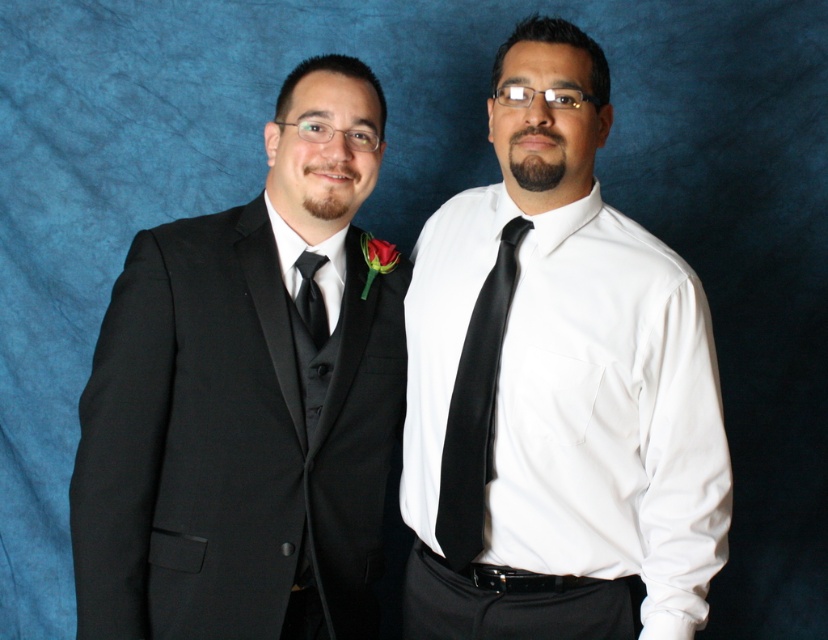
Question: Does black satin tie at center have a larger size compared to black satin tie at left?

Choices:
 (A) yes
 (B) no

Answer: (A)

Question: Which point is farther from the camera taking this photo?

Choices:
 (A) (75, 556)
 (B) (656, 541)
 (C) (306, 250)

Answer: (C)

Question: Which object is closer to the camera taking this photo?

Choices:
 (A) black satin tie at center
 (B) black satin tie at left
 (C) matte black suit at left

Answer: (C)

Question: Is white satin shirt at center bigger than black satin tie at center?

Choices:
 (A) no
 (B) yes

Answer: (B)

Question: Can you confirm if white satin shirt at center is thinner than black satin tie at left?

Choices:
 (A) no
 (B) yes

Answer: (A)

Question: Among these objects, which one is nearest to the camera?

Choices:
 (A) matte black suit at left
 (B) black satin tie at center
 (C) black satin tie at left

Answer: (A)